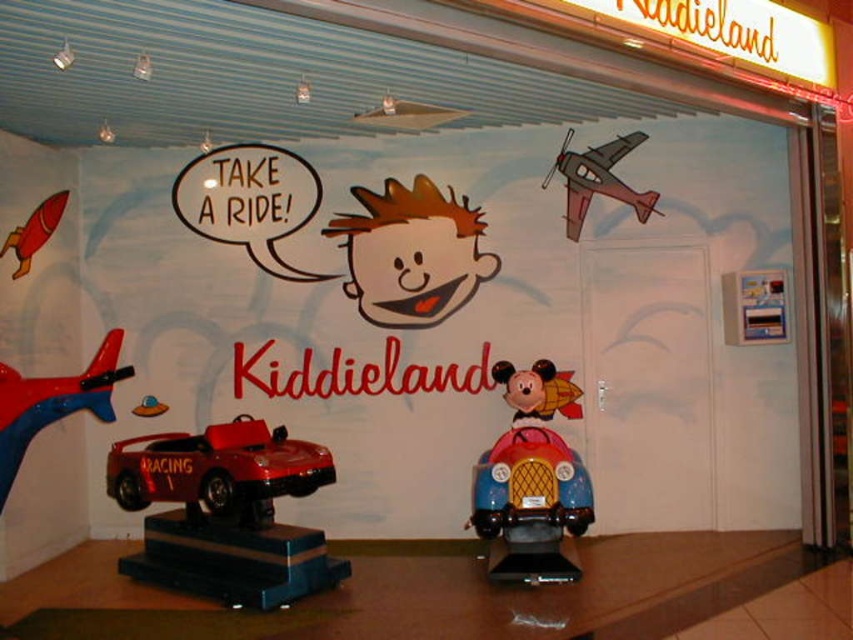
Can you confirm if shiny blue plastic car at center is taller than shiny red rocket at left?

Indeed, shiny blue plastic car at center has a greater height compared to shiny red rocket at left.

Between point (578, 531) and point (22, 259), which one is positioned in front?

Point (578, 531) is more forward.

Is point (527, 440) farther from viewer compared to point (39, 211)?

That is False.

Identify the location of shiny blue plastic car at center. (532, 477).

Who is positioned more to the right, metallic red car at lower left or shiny red car at left?

metallic red car at lower left

Does metallic red car at lower left have a greater height compared to shiny red car at left?

No, metallic red car at lower left is not taller than shiny red car at left.

Describe the element at coordinates (233, 560) in the screenshot. I see `metallic red car at lower left` at that location.

At what (x,y) coordinates should I click in order to perform the action: click on metallic red car at lower left. Please return your answer as a coordinate pair (x, y). Looking at the image, I should click on (233, 560).

In the scene shown: Between shiny blue plastic car at center and shiny red car at left, which one has less height?

shiny red car at left

Is point (548, 497) closer to viewer compared to point (1, 401)?

That is False.

This screenshot has width=853, height=640. What are the coordinates of `shiny blue plastic car at center` in the screenshot? It's located at (532, 477).